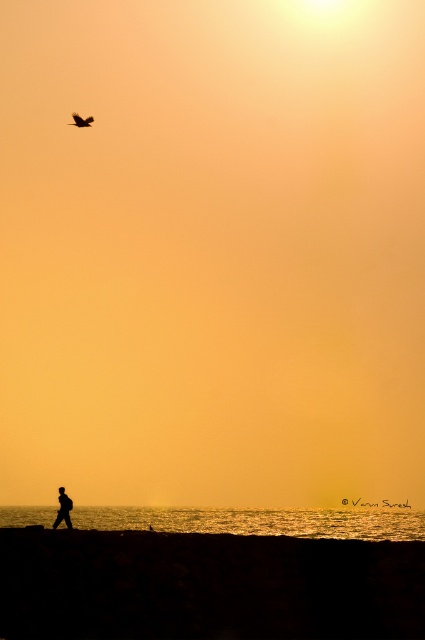
Question: Can you confirm if black silhouette person at lower left is positioned to the right of dark brown feathers at upper left?

Choices:
 (A) no
 (B) yes

Answer: (B)

Question: Does black silhouette person at lower left appear on the left side of dark brown feathers at upper left?

Choices:
 (A) no
 (B) yes

Answer: (A)

Question: Which point is farther to the camera?

Choices:
 (A) (79, 116)
 (B) (68, 524)

Answer: (A)

Question: Does black silhouette person at lower left appear on the left side of dark brown feathers at upper left?

Choices:
 (A) no
 (B) yes

Answer: (A)

Question: Which object appears farthest from the camera in this image?

Choices:
 (A) black silhouette person at lower left
 (B) dark brown feathers at upper left

Answer: (B)